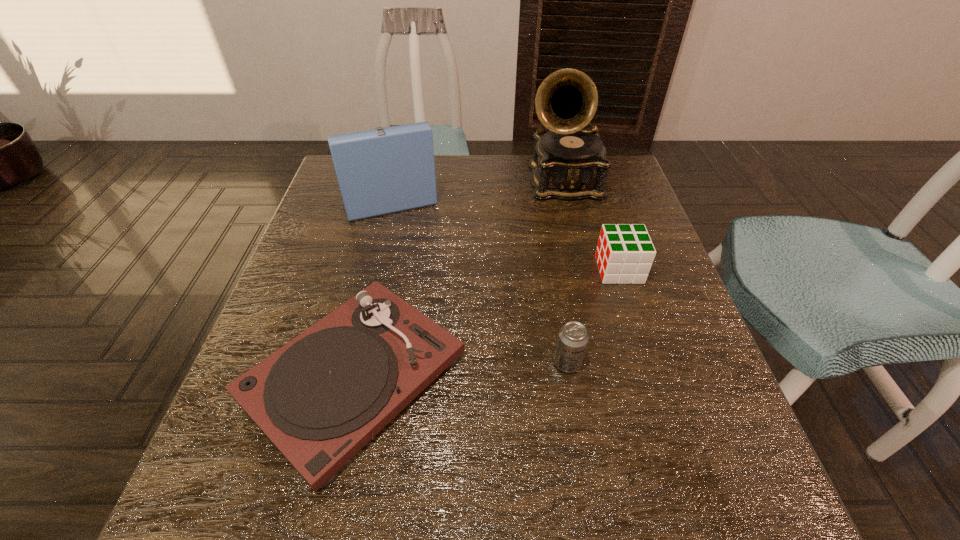
Where is `the rightmost phonograph_record`? The image size is (960, 540). the rightmost phonograph_record is located at coordinates (569, 163).

Find the location of a particular element. This screenshot has width=960, height=540. the tallest object is located at coordinates (569, 163).

Identify the location of the second tallest object. (381, 171).

Find the location of a particular element. beer can is located at coordinates (573, 338).

Where is `the third nearest object`? The image size is (960, 540). the third nearest object is located at coordinates (624, 254).

Identify the location of the shortest phonograph_record. (320, 398).

You are a GUI agent. You are given a task and a screenshot of the screen. Output one action in this format:
    pyautogui.click(x=<x>, y=<y>)
    Task: Click on the nearest phonograph_record
    
    Given the screenshot: What is the action you would take?
    pyautogui.click(x=320, y=398)

Locate an element on the screen. vacant space situated 0.380m on the horn of the tallest object is located at coordinates (597, 327).

This screenshot has width=960, height=540. Find the location of `vacant space situated on the front of the second tallest object`. vacant space situated on the front of the second tallest object is located at coordinates (372, 241).

Where is `free location located 0.330m on the back of the beer can`? The width and height of the screenshot is (960, 540). free location located 0.330m on the back of the beer can is located at coordinates (547, 239).